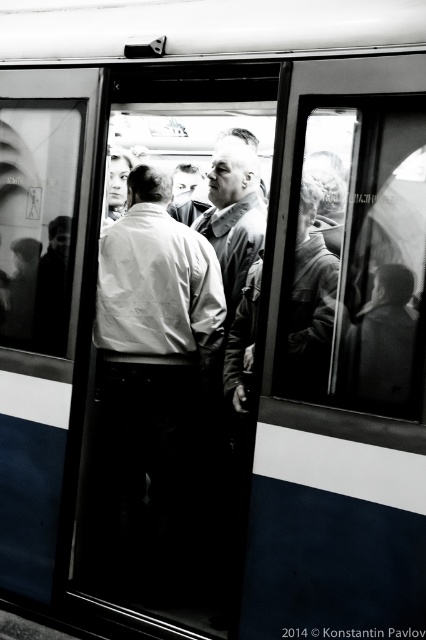
You are a passenger on the subway and you notice two people near the doors. One is wearing a white shirt at center and the other a matte gray jacket at center. From your perspective inside the train, which one is positioned closer to the platform?

The white shirt at center is to the left of matte gray jacket at center, so it is closer to the platform since the platform is outside the train doors and the left side of the train interior faces towards it.